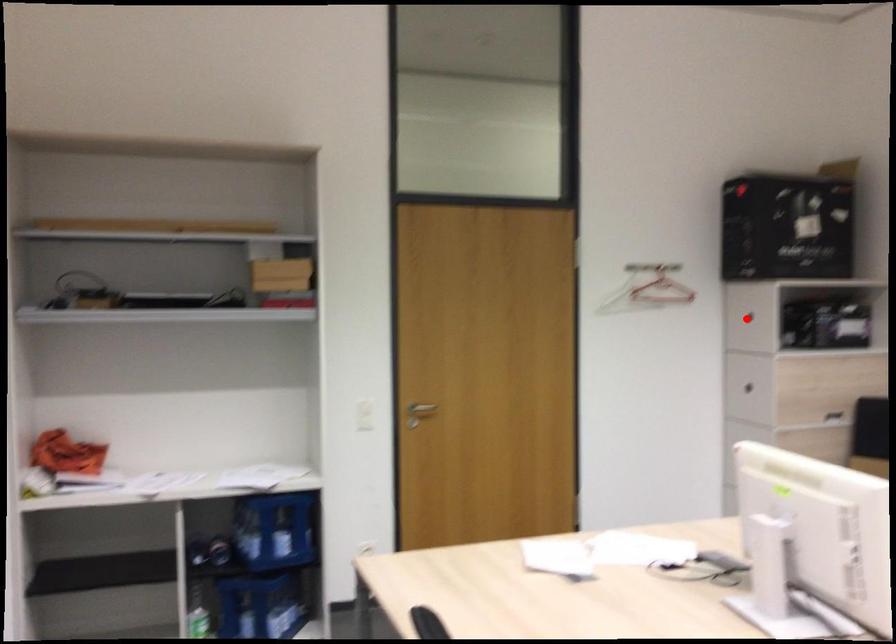
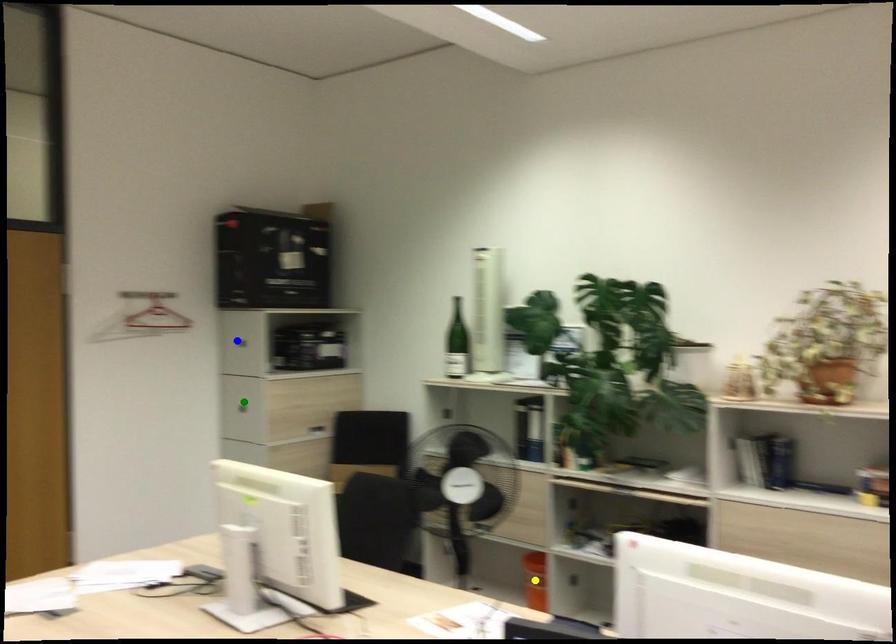
Question: I am providing you with two images of the same scene from different viewpoints. A red point is marked on the first image. You are given multiple points on the second image. Which point in image 2 is actually the same real-world point as the red point in image 1?

Choices:
 (A) blue point
 (B) green point
 (C) yellow point

Answer: (A)